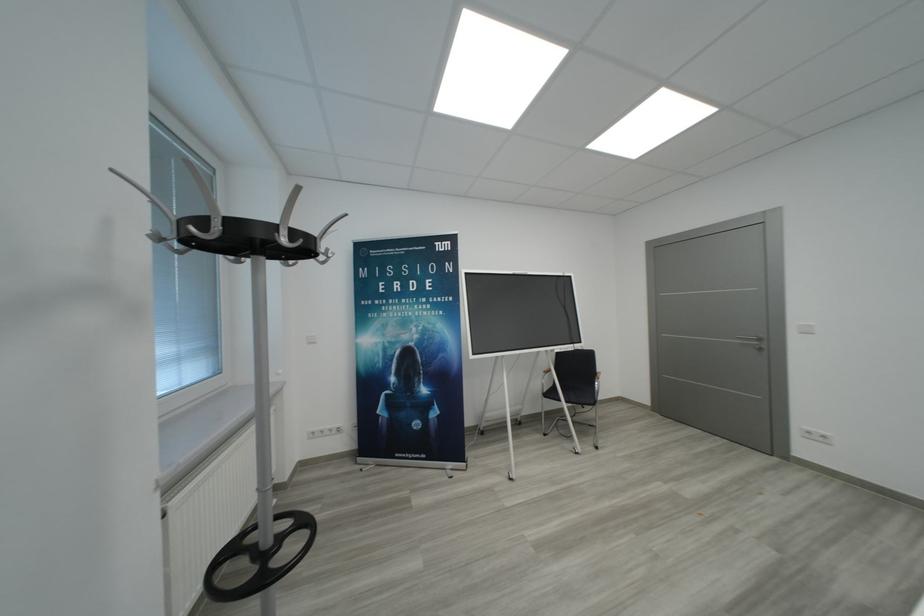
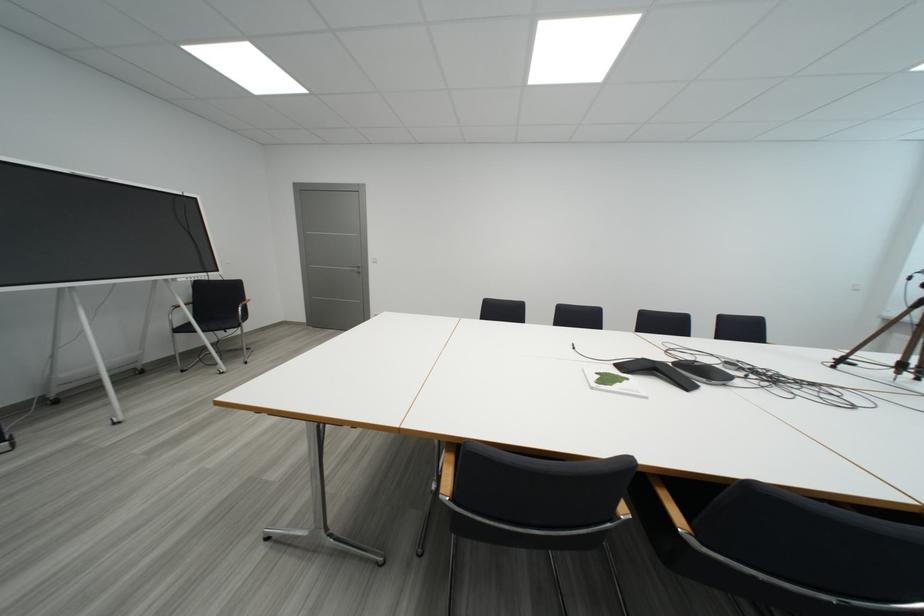
Where in the second image is the point corresponding to pixel 584 376 from the first image?

(228, 306)